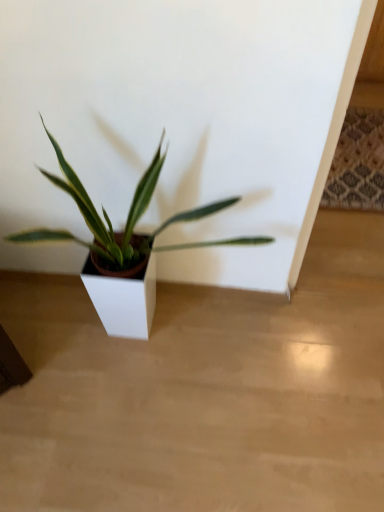
I want to click on vacant space to the right of green glossy plant at center, so click(309, 368).